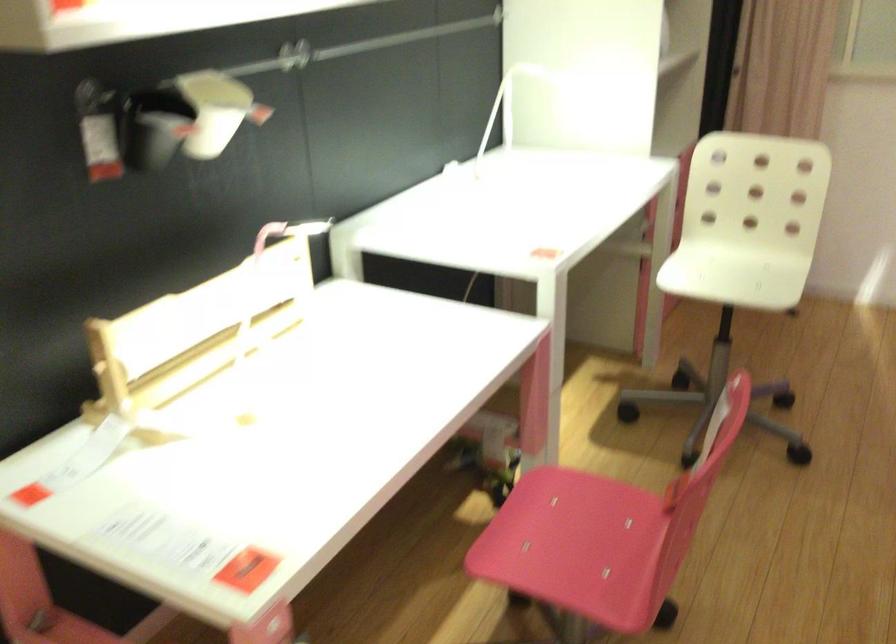
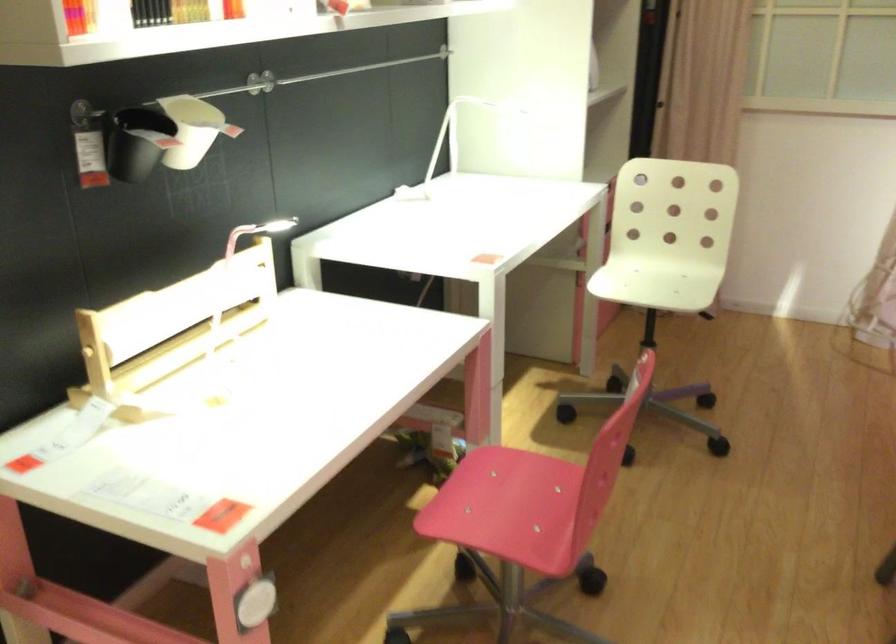
Question: I am providing you with two images of the same scene from different viewpoints. After the viewpoint changes to image2, which objects are now occluded?

Choices:
 (A) white chair sitting surface
 (B) black hanging container
 (C) white lamp head
 (D) none of these

Answer: (D)